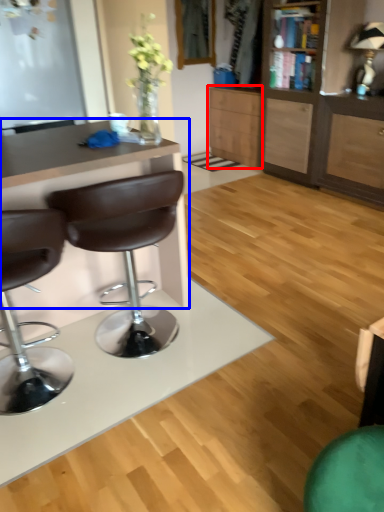
Question: Among these objects, which one is nearest to the camera, cabinetry (highlighted by a red box) or desk (highlighted by a blue box)?

Choices:
 (A) cabinetry
 (B) desk

Answer: (B)